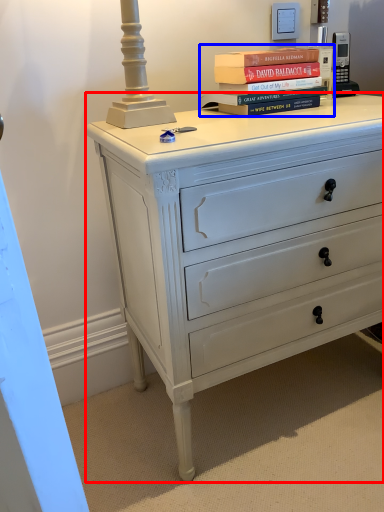
Question: Which object appears farthest to the camera in this image, chest of drawers (highlighted by a red box) or book (highlighted by a blue box)?

Choices:
 (A) chest of drawers
 (B) book

Answer: (B)